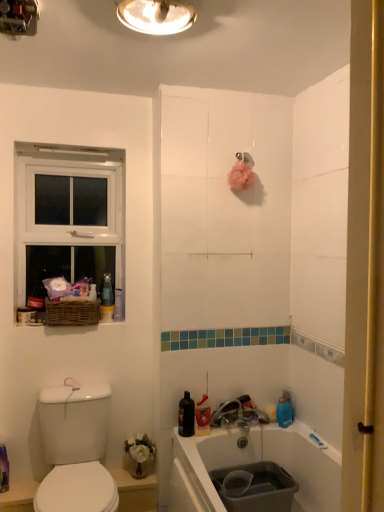
Question: Is metallic ceiling light at upper center, which is the 2th light fixture in right-to-left order, thinner than metallic dome at upper center, which appears as the 2th light fixture when viewed from the left?

Choices:
 (A) no
 (B) yes

Answer: (B)

Question: Considering the relative positions of metallic ceiling light at upper center, which is the 2th light fixture in right-to-left order, and metallic dome at upper center, which appears as the 2th light fixture when viewed from the left, in the image provided, is metallic ceiling light at upper center, which is the 2th light fixture in right-to-left order, behind metallic dome at upper center, which appears as the 2th light fixture when viewed from the left,?

Choices:
 (A) yes
 (B) no

Answer: (A)

Question: From the image's perspective, is metallic ceiling light at upper center, which is the 2th light fixture in right-to-left order, beneath metallic dome at upper center, which appears as the 2th light fixture when viewed from the left?

Choices:
 (A) yes
 (B) no

Answer: (A)

Question: Is metallic ceiling light at upper center, which is the 2th light fixture in right-to-left order, oriented away from metallic dome at upper center, which ranks as the first light fixture in right-to-left order?

Choices:
 (A) no
 (B) yes

Answer: (A)

Question: Is metallic ceiling light at upper center, which is the 2th light fixture in right-to-left order, not within metallic dome at upper center, which appears as the 2th light fixture when viewed from the left?

Choices:
 (A) yes
 (B) no

Answer: (A)

Question: Could you tell me if metallic ceiling light at upper center, which is the 2th light fixture in right-to-left order, is turned towards metallic dome at upper center, which ranks as the first light fixture in right-to-left order?

Choices:
 (A) no
 (B) yes

Answer: (A)

Question: Is white glossy bidet at lower left closer to camera compared to metallic dome at upper center, which appears as the 2th light fixture when viewed from the left?

Choices:
 (A) no
 (B) yes

Answer: (A)

Question: Can you see white glossy bidet at lower left touching metallic dome at upper center, which ranks as the first light fixture in right-to-left order?

Choices:
 (A) no
 (B) yes

Answer: (A)

Question: Is white glossy bidet at lower left aimed at metallic dome at upper center, which appears as the 2th light fixture when viewed from the left?

Choices:
 (A) yes
 (B) no

Answer: (B)

Question: From the image's perspective, is white glossy bidet at lower left below metallic dome at upper center, which appears as the 2th light fixture when viewed from the left?

Choices:
 (A) no
 (B) yes

Answer: (B)

Question: Can you confirm if white glossy bidet at lower left is wider than metallic dome at upper center, which appears as the 2th light fixture when viewed from the left?

Choices:
 (A) no
 (B) yes

Answer: (A)

Question: From a real-world perspective, is white glossy bidet at lower left located beneath metallic dome at upper center, which ranks as the first light fixture in right-to-left order?

Choices:
 (A) yes
 (B) no

Answer: (A)

Question: From a real-world perspective, is metallic ceiling light at upper center, the 1th light fixture positioned from the left, positioned over white plastic window at upper left based on gravity?

Choices:
 (A) no
 (B) yes

Answer: (B)